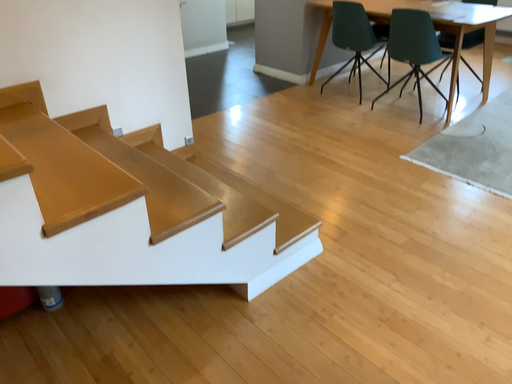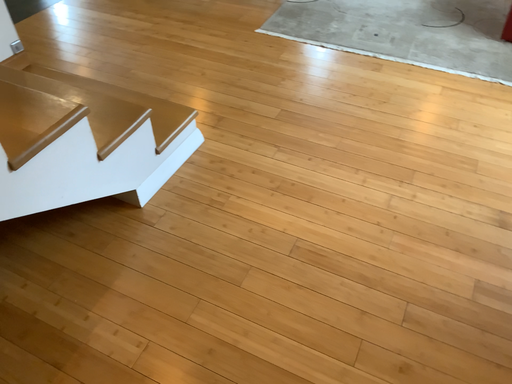
Question: Which way did the camera rotate in the video?

Choices:
 (A) rotated left
 (B) rotated right

Answer: (B)